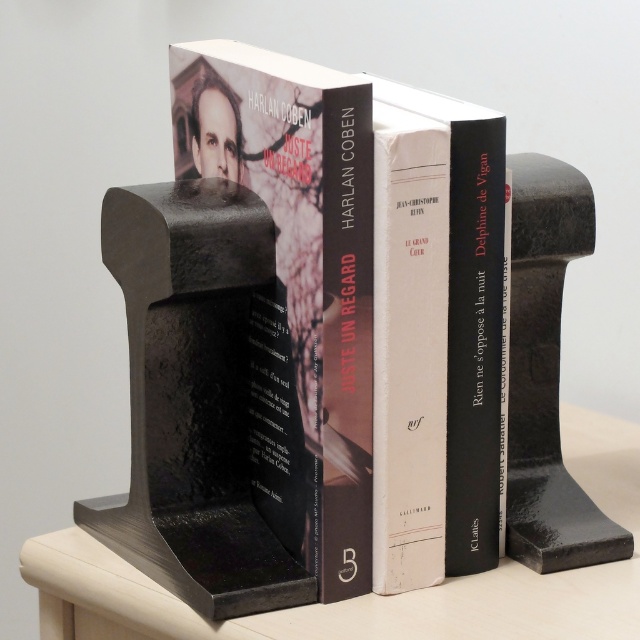
Is matte black book at center behind smooth matte black bookends at center?

No, matte black book at center is in front of smooth matte black bookends at center.

Is matte black book at center positioned before smooth matte black bookends at center?

Yes, it is.

Which is in front, point (342, 147) or point (365, 630)?

Point (342, 147)

Locate an element on the screen. This screenshot has width=640, height=640. matte black book at center is located at coordinates (298, 285).